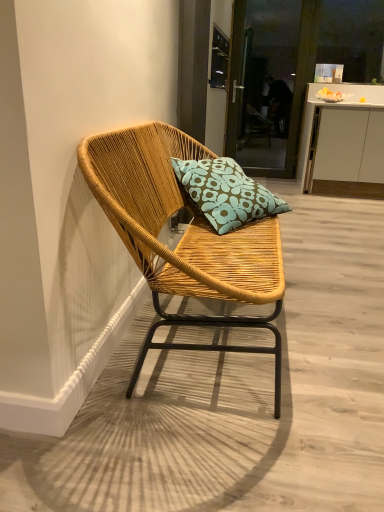
Where is `free point to the right of woven wood chair at center`? The height and width of the screenshot is (512, 384). free point to the right of woven wood chair at center is located at coordinates (331, 322).